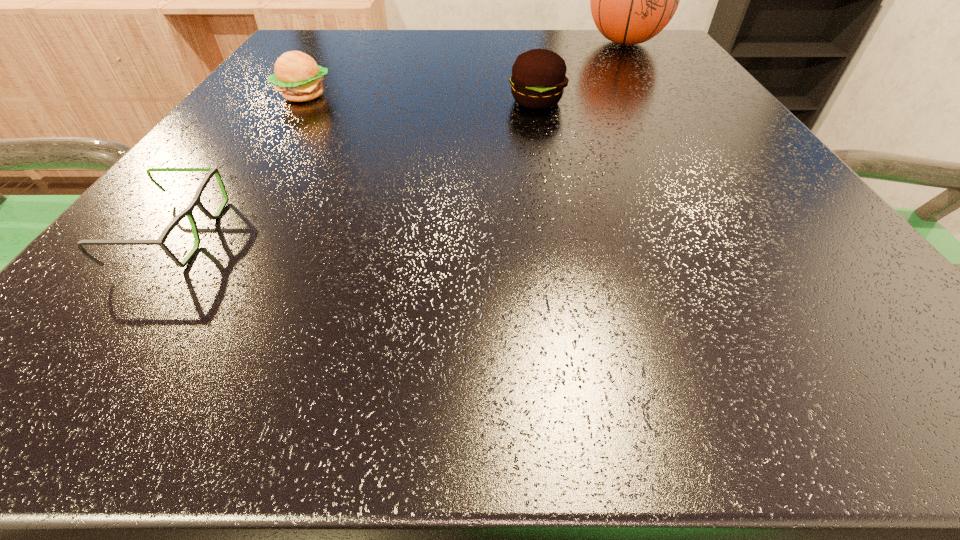
Image resolution: width=960 pixels, height=540 pixels. What are the coordinates of `unoccupied area between the third object from left to right and the farthest object` in the screenshot? It's located at (581, 72).

The height and width of the screenshot is (540, 960). What are the coordinates of `free space between the nearest object and the hamburger` in the screenshot? It's located at (238, 164).

The height and width of the screenshot is (540, 960). Identify the location of blank region between the hamburger and the basketball. (465, 69).

This screenshot has height=540, width=960. In order to click on the closest object to the rightmost object in this screenshot , I will do `click(538, 78)`.

Where is `object identified as the second closest to the nearest object`? object identified as the second closest to the nearest object is located at coordinates pyautogui.click(x=538, y=78).

This screenshot has width=960, height=540. Identify the location of vacant point that satisfies the following two spatial constraints: 1. on the front side of the farthest object; 2. on the lens of the nearest object. (749, 233).

Find the location of a particular element. vacant space that satisfies the following two spatial constraints: 1. on the front side of the farthest object; 2. on the lens of the shortest object is located at coordinates (749, 233).

Find the location of a particular element. This screenshot has height=540, width=960. free spot that satisfies the following two spatial constraints: 1. on the back side of the farthest object; 2. on the right side of the hamburger is located at coordinates (338, 43).

Locate an element on the screen. The image size is (960, 540). free space in the image that satisfies the following two spatial constraints: 1. on the front side of the hamburger; 2. on the lens of the spectacles is located at coordinates (216, 233).

Where is `free location that satisfies the following two spatial constraints: 1. on the back side of the tallest object; 2. on the right side of the third object from left to right`? This screenshot has height=540, width=960. free location that satisfies the following two spatial constraints: 1. on the back side of the tallest object; 2. on the right side of the third object from left to right is located at coordinates (524, 43).